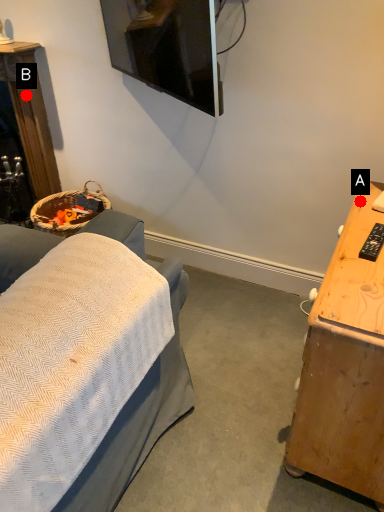
Question: Two points are circled on the image, labeled by A and B beside each circle. Which point is further to the camera?

Choices:
 (A) A is further
 (B) B is further

Answer: (B)